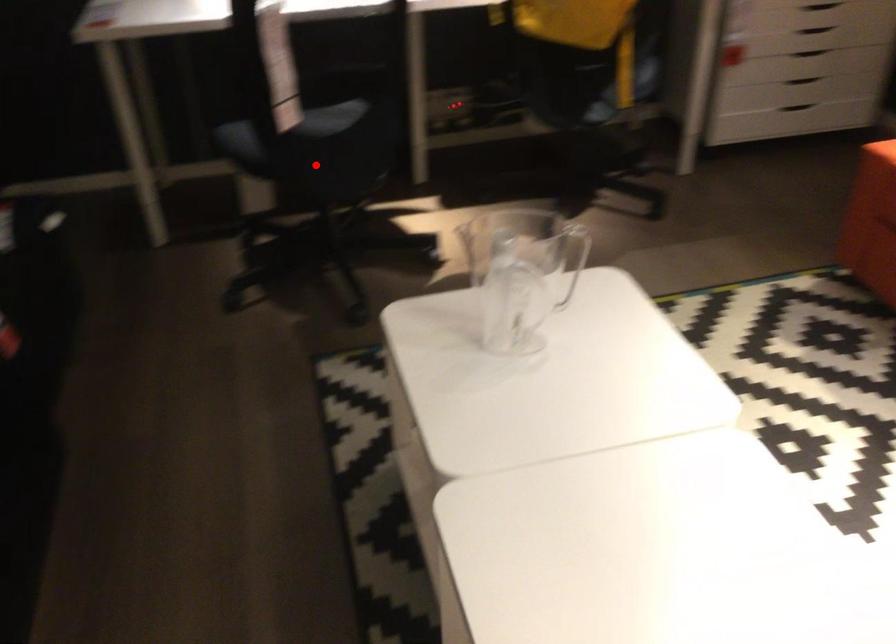
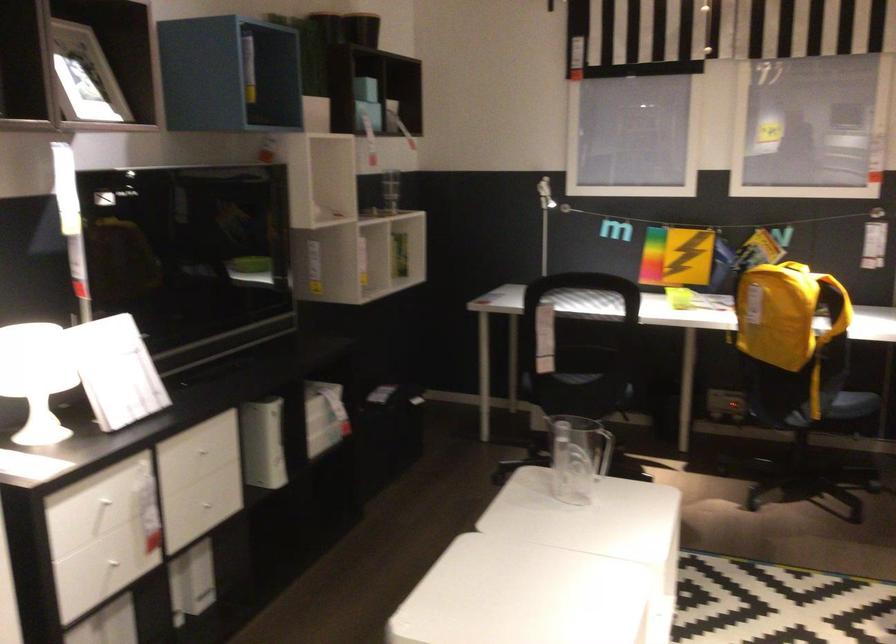
Where in the second image is the point corresponding to the highlighted location from the first image?

(571, 393)